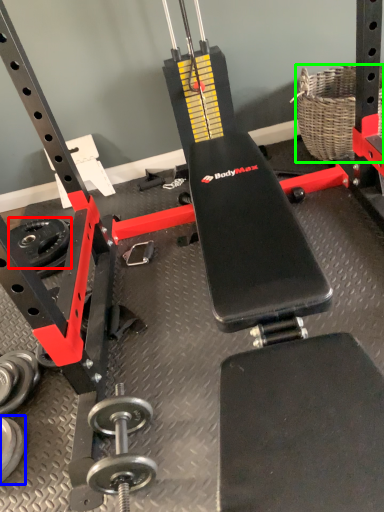
Question: Based on their relative distances, which object is farther from wheel (highlighted by a red box)? Choose from dumbbell (highlighted by a blue box) and basket (highlighted by a green box).

Choices:
 (A) dumbbell
 (B) basket

Answer: (B)